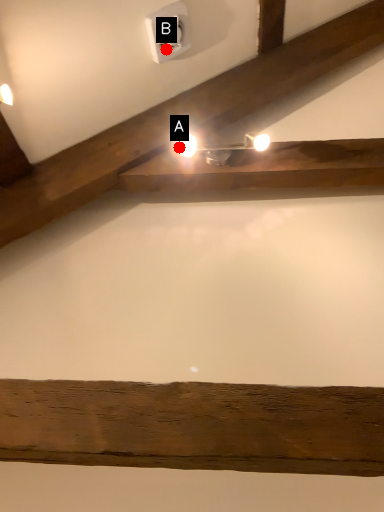
Question: Two points are circled on the image, labeled by A and B beside each circle. Which point is closer to the camera?

Choices:
 (A) A is closer
 (B) B is closer

Answer: (A)